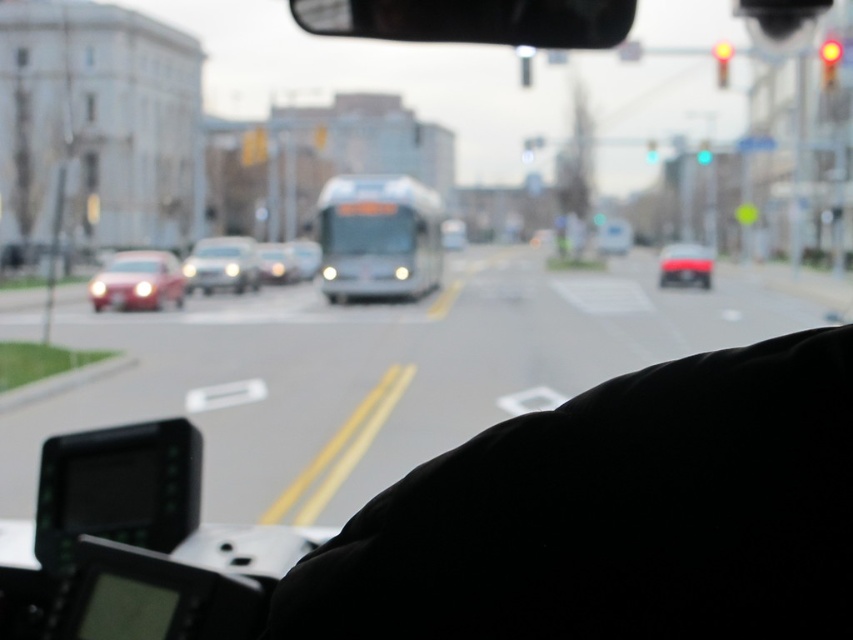
You are a passenger in a moving vehicle and notice two vehicles outside the window. You see a matte red car at center and a metallic silver bus at center. Which of these two vehicles is taller?

The matte red car at center is taller than the metallic silver bus at center according to the description provided.

You are a passenger on a bus and notice two traffic lights outside the window. The red glass traffic light at upper right and the green glass traffic light at upper center. Which traffic light is positioned higher in the image?

The red glass traffic light at upper right is located above the green glass traffic light at upper center, so it is positioned higher in the image.

You are a passenger on a bus and want to know the exact position of the metallic silver bus at center relative to the road markings. Can you determine its coordinates?

The metallic silver bus at center is located at point (305, 257) according to the coordinates provided.